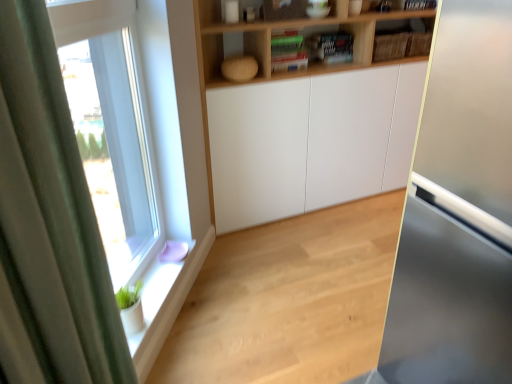
I want to click on vacant space underneath white glossy window sill at lower left (from a real-world perspective), so click(x=182, y=302).